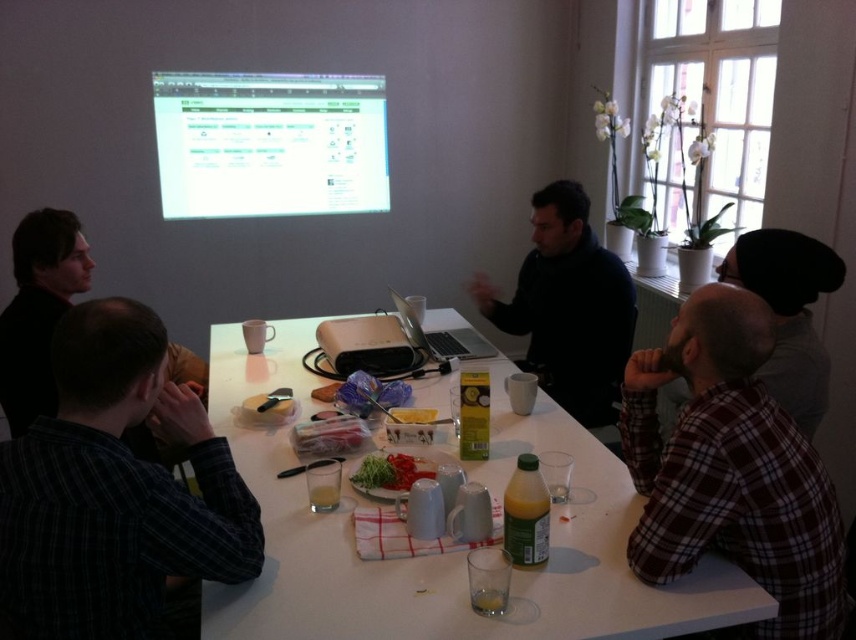
Does white glossy projection screen at upper center appear over matte black projector at center?

Correct, white glossy projection screen at upper center is located above matte black projector at center.

Does white glossy projection screen at upper center lie behind matte black projector at center?

Yes, it is behind matte black projector at center.

Does point (296, 186) come closer to viewer compared to point (401, 369)?

No, it is not.

The height and width of the screenshot is (640, 856). I want to click on white glossy projection screen at upper center, so click(269, 144).

Who is more distant from viewer, (744, 296) or (165, 128)?

The point (165, 128) is more distant.

Between point (679, 520) and point (354, 76), which one is positioned behind?

Point (354, 76)

This screenshot has width=856, height=640. Identify the location of brown plaid shirt at lower right. (730, 468).

Who is taller, white glossy projection screen at upper center or smooth brown bread at center?

white glossy projection screen at upper center

Between white glossy projection screen at upper center and smooth brown bread at center, which one has less height?

Standing shorter between the two is smooth brown bread at center.

Where is `white glossy projection screen at upper center`? white glossy projection screen at upper center is located at coordinates (269, 144).